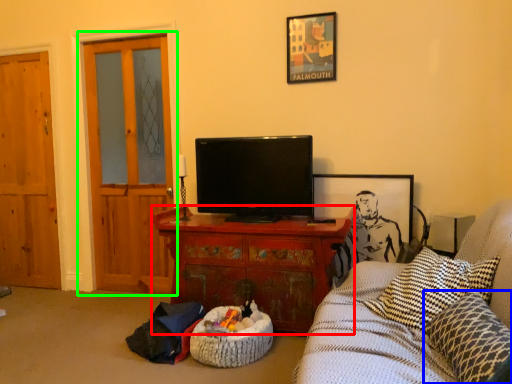
Question: Based on their relative distances, which object is nearer to cabinetry (highlighted by a red box)? Choose from pillow (highlighted by a blue box) and door (highlighted by a green box).

Choices:
 (A) pillow
 (B) door

Answer: (B)